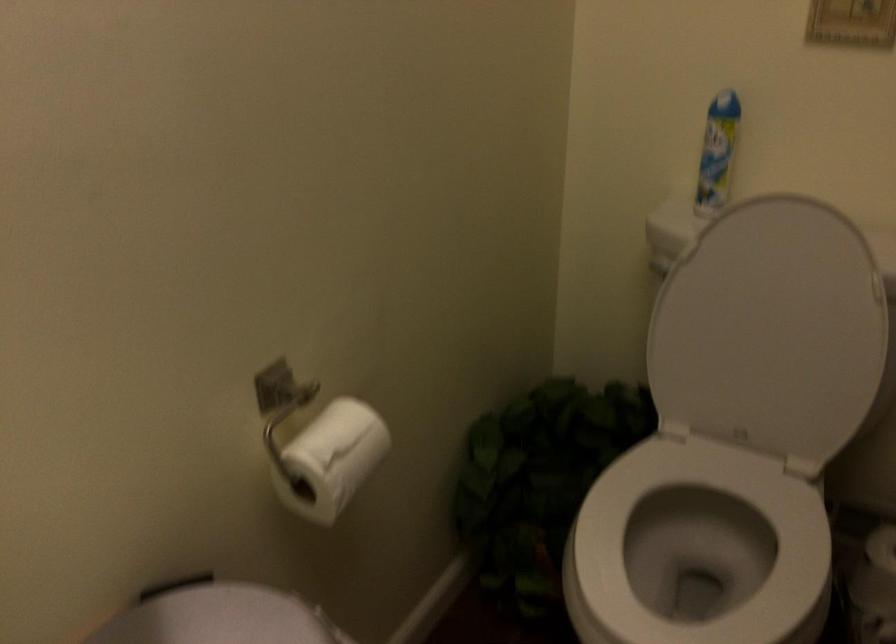
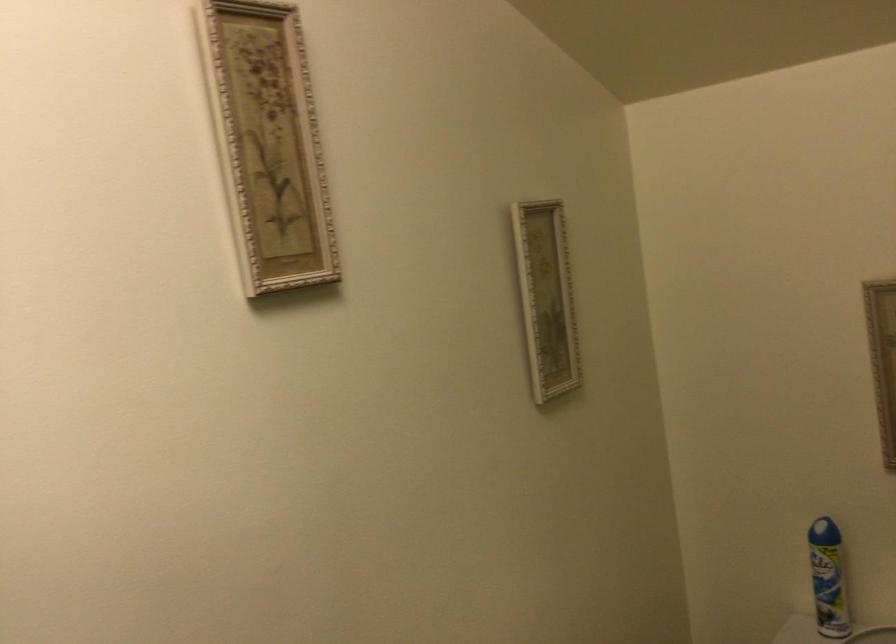
In a continuous first-person perspective shot, in which direction is the camera moving?

The movement direction of the cameraman is right, backward.